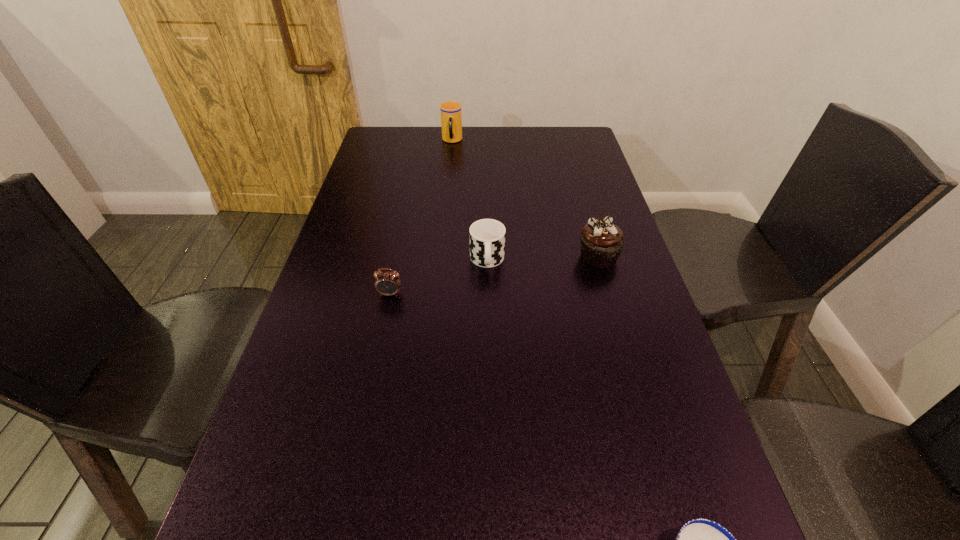
I want to click on the leftmost cup, so click(x=451, y=111).

Locate an element on the screen. Image resolution: width=960 pixels, height=540 pixels. the second object from left to right is located at coordinates (451, 111).

You are a GUI agent. You are given a task and a screenshot of the screen. Output one action in this format:
    pyautogui.click(x=<x>, y=<y>)
    Task: Click on the cupcake
    The height and width of the screenshot is (540, 960).
    Given the screenshot: What is the action you would take?
    pyautogui.click(x=602, y=242)

You are a GUI agent. You are given a task and a screenshot of the screen. Output one action in this format:
    pyautogui.click(x=<x>, y=<y>)
    Task: Click on the second tallest cup
    Image resolution: width=960 pixels, height=540 pixels.
    Given the screenshot: What is the action you would take?
    pyautogui.click(x=487, y=236)

Locate an element on the screen. the second cup from left to right is located at coordinates (487, 236).

Image resolution: width=960 pixels, height=540 pixels. Identify the location of the leftmost object. (386, 283).

The width and height of the screenshot is (960, 540). What are the coordinates of `the second nearest object` in the screenshot? It's located at (386, 283).

Identify the location of vacant space positioned on the side of the farthest object with the handle. (449, 165).

This screenshot has height=540, width=960. I want to click on vacant point located on the back of the cupcake, so click(x=579, y=190).

Locate an element on the screen. The height and width of the screenshot is (540, 960). vacant area situated 0.340m on the side of the third object from left to right with the handle is located at coordinates (490, 401).